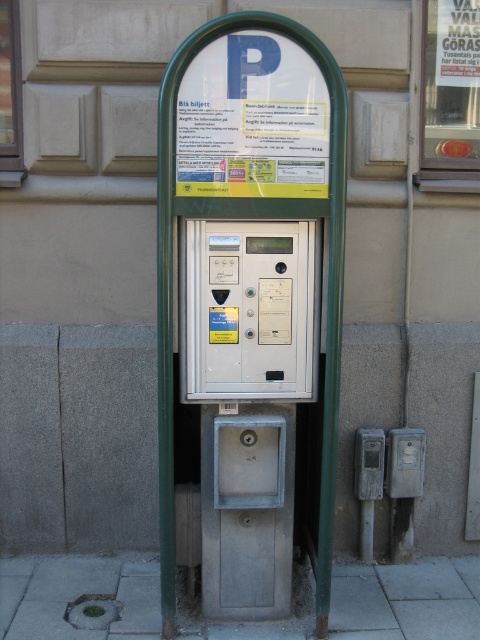
Where is `metallic gray parking meter at center`? The width and height of the screenshot is (480, 640). metallic gray parking meter at center is located at coordinates (251, 298).

From the picture: Can you confirm if metallic gray parking meter at center is positioned to the left of gray concrete pavement at lower left?

In fact, metallic gray parking meter at center is to the right of gray concrete pavement at lower left.

Find the location of a particular element. metallic gray parking meter at center is located at coordinates (251, 298).

You are a GUI agent. You are given a task and a screenshot of the screen. Output one action in this format:
    pyautogui.click(x=<x>, y=<y>)
    Task: Click on the metallic gray parking meter at center
    The image size is (480, 640).
    Given the screenshot: What is the action you would take?
    pyautogui.click(x=251, y=298)

Who is taller, gray concrete pavement at lower left or white plastic parking meter at center?

white plastic parking meter at center is taller.

Who is lower down, gray concrete pavement at lower left or white plastic parking meter at center?

gray concrete pavement at lower left is lower down.

Does point (358, 579) lie in front of point (288, 241)?

No, (358, 579) is further to viewer.

What are the coordinates of `gray concrete pavement at lower left` in the screenshot? It's located at (79, 596).

Is the position of metallic gray parking meter at center less distant than that of white plastic parking meter at center?

Yes, metallic gray parking meter at center is closer to the viewer.

Is metallic gray parking meter at center taller than white plastic parking meter at center?

Yes.

Is point (215, 316) closer to camera compared to point (262, 374)?

That is True.

I want to click on metallic gray parking meter at center, so click(251, 298).